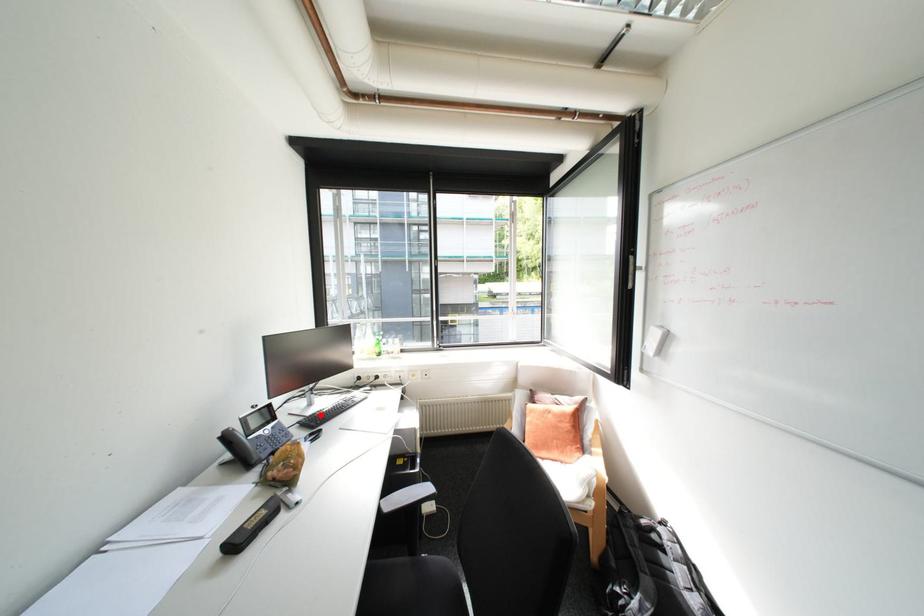
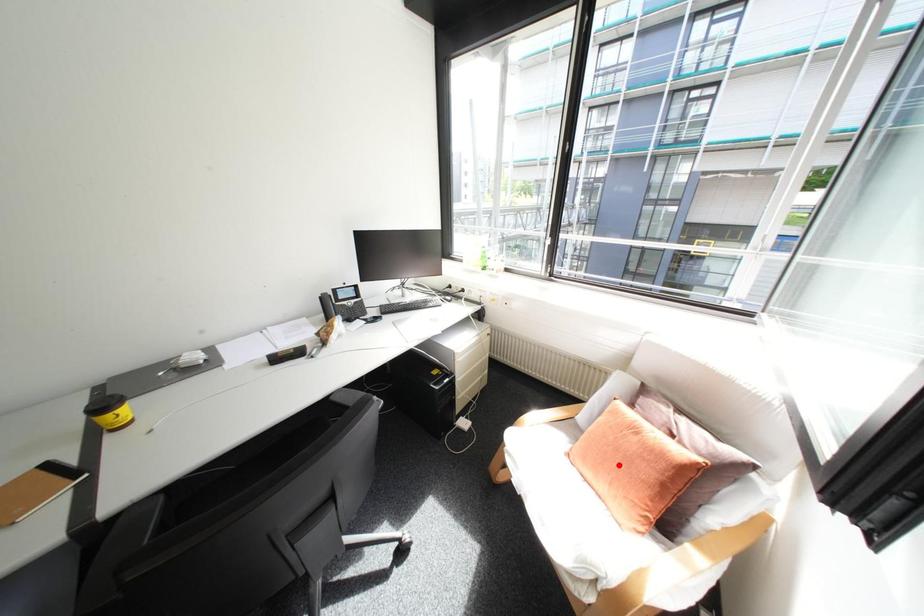
I am providing you with two images of the same scene from different viewpoints. A red point is marked on the first image and another point is marked on the second image. Is the red point in image1 aligned with the point shown in image2?

No